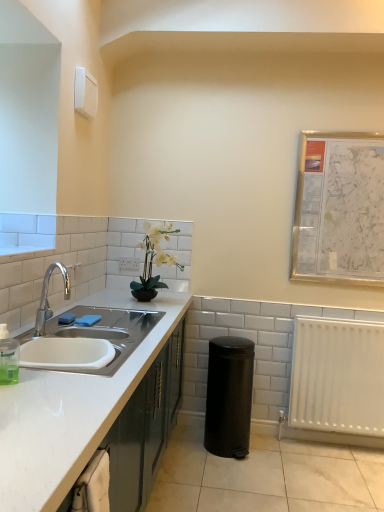
Where is `free spot in front of translucent plastic soap dispenser at sink left`? free spot in front of translucent plastic soap dispenser at sink left is located at coordinates (17, 400).